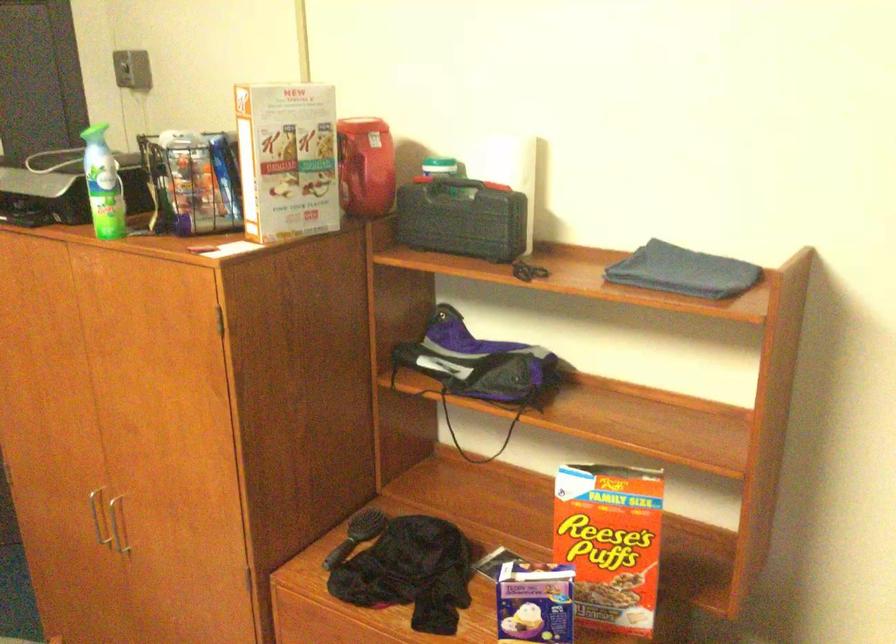
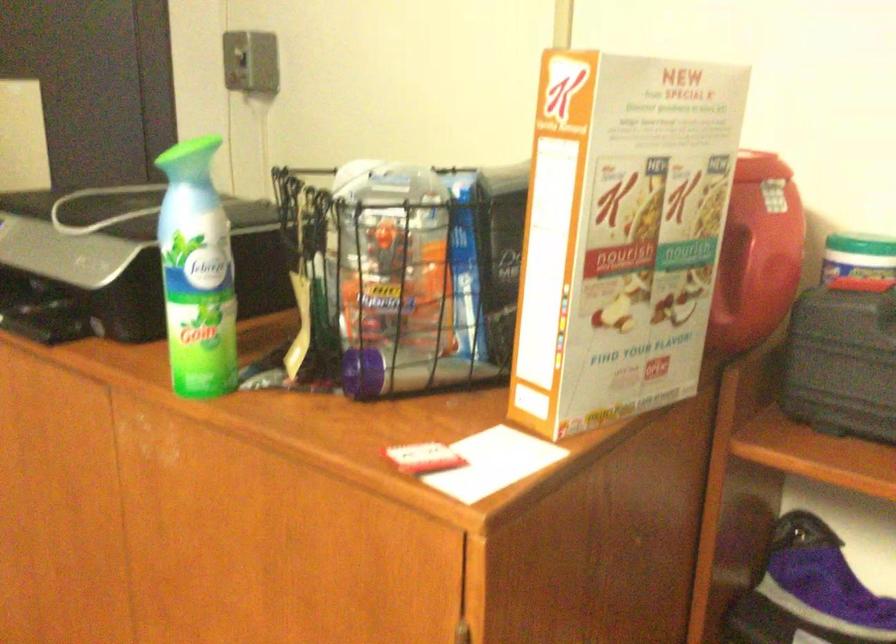
Where in the second image is the point corresponding to point (444, 345) from the first image?

(808, 592)